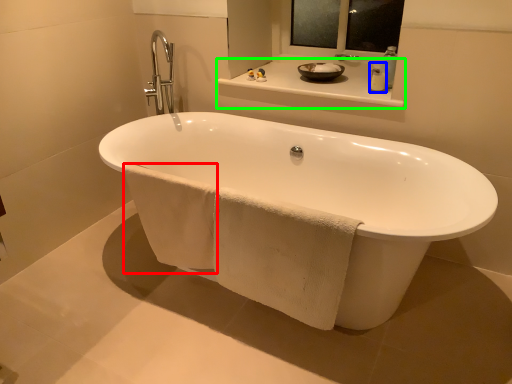
Question: Which object is positioned closest to bath towel (highlighted by a red box)? Select from soap dispenser (highlighted by a blue box) and counter top (highlighted by a green box).

Choices:
 (A) soap dispenser
 (B) counter top

Answer: (B)